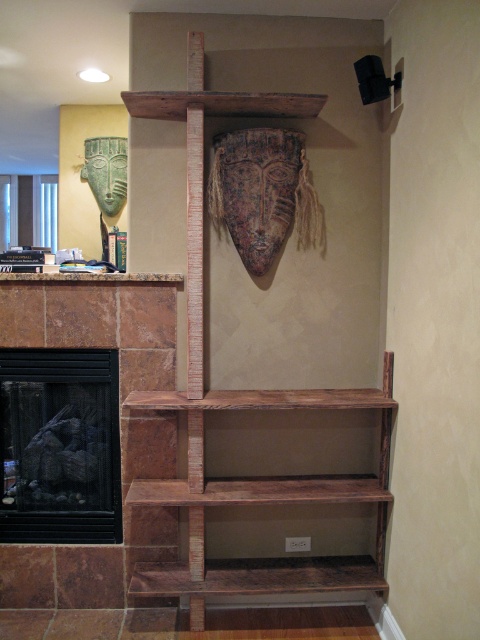
You are standing in the room and want to place a new painting on the wall between the rustic wood bookshelf at center and the black glass fireplace at left. Considering their positions, which object should the painting be closer to if it needs to be equidistant from both?

The painting should be closer to the rustic wood bookshelf at center because it is nearer to the viewer than the black glass fireplace at left, so placing it midway between them would require it to be closer to the bookshelf to maintain equal distance.

You are standing in the room and want to place a small plant between the black glass fireplace at left and the brown wood mantle at upper center. Based on their positions, which side of the mantle should you place it on?

The black glass fireplace at left is to the left of the brown wood mantle at upper center, so you should place the small plant to the right side of the brown wood mantle at upper center to position it between them.

You are a painter standing in front of the black glass fireplace at left and the brown wood mantle at upper center. You want to paint a picture of the fireplace first. Which object should you turn towards first?

You should turn towards the black glass fireplace at left first because the brown wood mantle at upper center is behind it, making the fireplace more accessible from your current position.